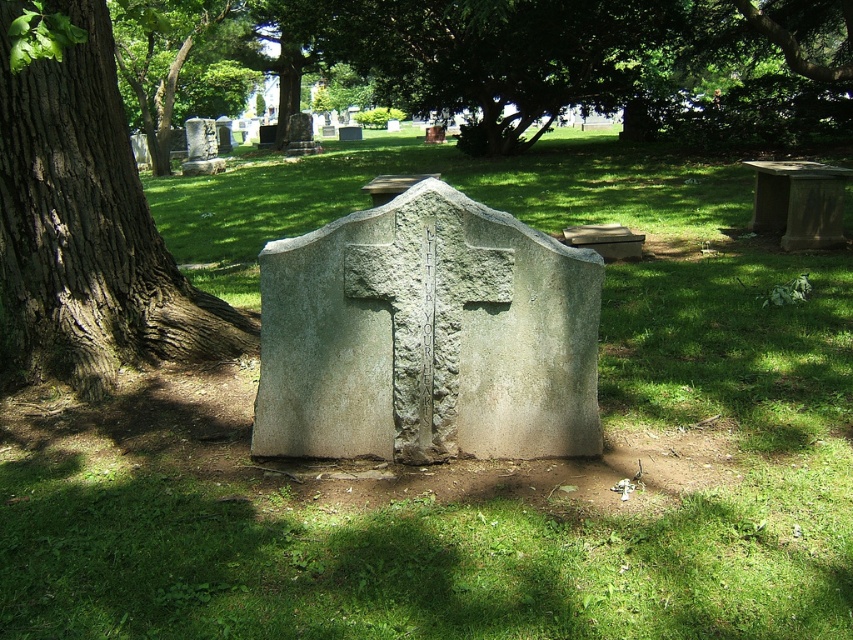
Does gray stone cross at center have a larger size compared to green leafy tree at upper center?

Indeed, gray stone cross at center has a larger size compared to green leafy tree at upper center.

Does point (291, 378) come closer to viewer compared to point (315, 51)?

Yes, point (291, 378) is in front of point (315, 51).

In order to click on gray stone cross at center in this screenshot , I will do `click(427, 337)`.

The image size is (853, 640). What are the coordinates of `gray stone cross at center` in the screenshot? It's located at (427, 337).

Measure the distance from green leafy tree at upper center to green leafy tree at upper left.

The distance of green leafy tree at upper center from green leafy tree at upper left is 9.93 meters.

Is green leafy tree at upper center closer to camera compared to green leafy tree at upper left?

That is False.

Where is `green leafy tree at upper center`? The width and height of the screenshot is (853, 640). green leafy tree at upper center is located at coordinates [x=491, y=54].

Is dark brown bark tree at left further to the viewer compared to green leafy tree at upper left?

No, it is in front of green leafy tree at upper left.

What do you see at coordinates (86, 221) in the screenshot? I see `dark brown bark tree at left` at bounding box center [86, 221].

Find the location of a particular element. dark brown bark tree at left is located at coordinates (86, 221).